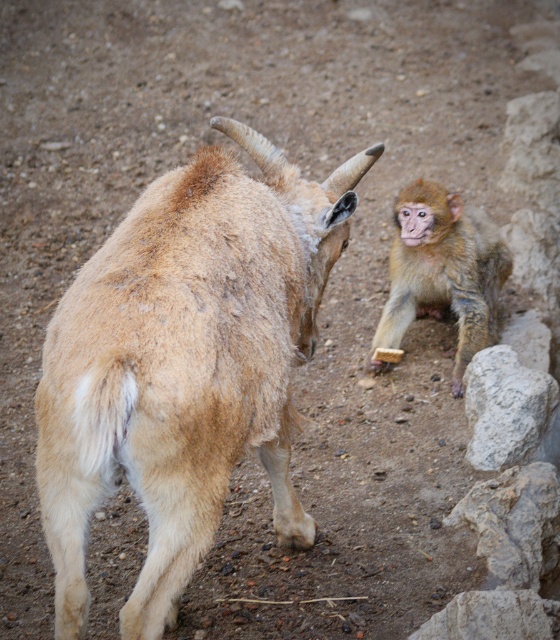
Question: Which object is farther from the camera taking this photo?

Choices:
 (A) light brown fur monkey at right
 (B) brown woolen goat at center

Answer: (A)

Question: Is brown woolen goat at center below light brown fur monkey at right?

Choices:
 (A) yes
 (B) no

Answer: (A)

Question: Does brown woolen goat at center appear under light brown fur monkey at right?

Choices:
 (A) no
 (B) yes

Answer: (B)

Question: Is brown woolen goat at center further to the viewer compared to light brown fur monkey at right?

Choices:
 (A) yes
 (B) no

Answer: (B)

Question: Which point is farther to the camera?

Choices:
 (A) light brown fur monkey at right
 (B) brown woolen goat at center

Answer: (A)

Question: Which point is closer to the camera taking this photo?

Choices:
 (A) (156, 624)
 (B) (450, 193)

Answer: (A)